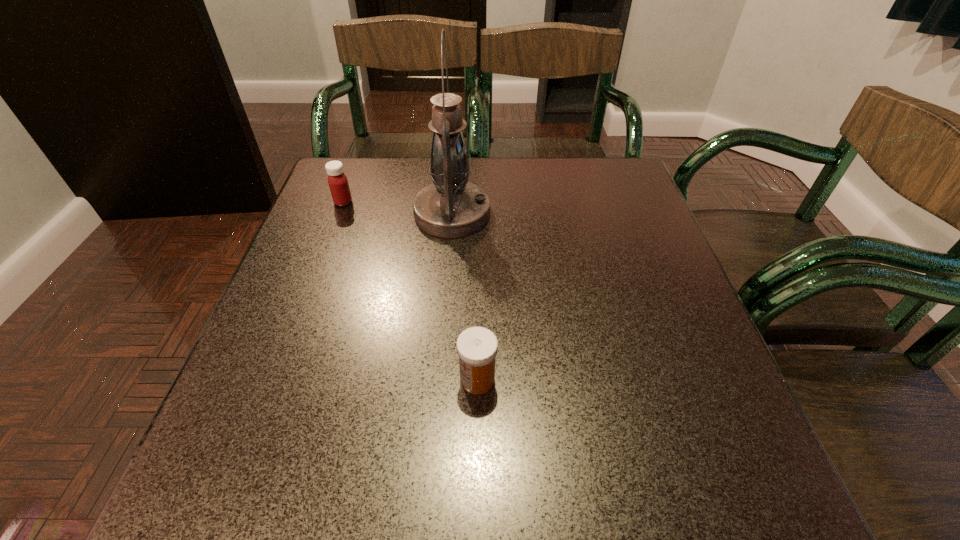
Image resolution: width=960 pixels, height=540 pixels. Identify the location of object that is at the left edge. (338, 183).

This screenshot has height=540, width=960. Identify the location of object located in the far left corner section of the desktop. (338, 183).

Identify the location of vacant space at the far edge. The image size is (960, 540). (511, 160).

Find the location of a particular element. This screenshot has height=540, width=960. free point at the near edge is located at coordinates (413, 497).

Where is `vacant space at the left edge of the desktop`? vacant space at the left edge of the desktop is located at coordinates (348, 275).

Find the location of a particular element. This screenshot has height=540, width=960. vacant area at the right edge is located at coordinates (676, 373).

In the image, there is a desktop. Identify the location of blank space at the far left corner. The height and width of the screenshot is (540, 960). (359, 181).

In the image, there is a desktop. At what (x,y) coordinates should I click in order to perform the action: click on vacant area at the near left corner. Please return your answer as a coordinate pair (x, y). Looking at the image, I should click on (211, 496).

The width and height of the screenshot is (960, 540). I want to click on free space between the leftmost object and the right medicine, so click(x=410, y=291).

Where is `unoccupied position between the farther medicine and the oil lamp`? The height and width of the screenshot is (540, 960). unoccupied position between the farther medicine and the oil lamp is located at coordinates (397, 208).